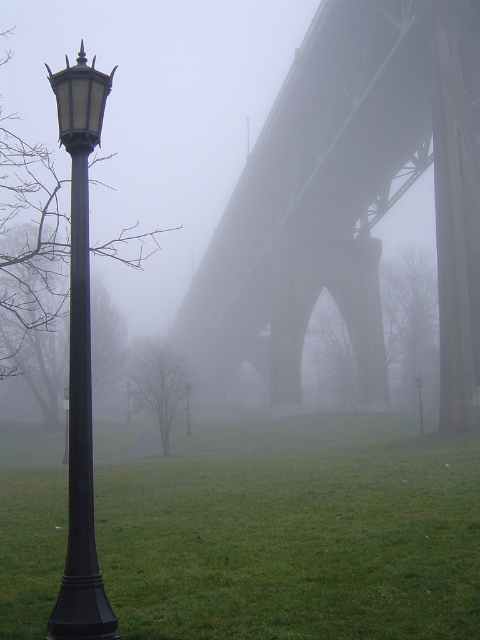
From the picture: Between dark gray concrete suspension bridge at center and matte black lamp post at left, which one has more height?

Standing taller between the two is matte black lamp post at left.

Can you confirm if dark gray concrete suspension bridge at center is positioned to the left of matte black lamp post at left?

No, dark gray concrete suspension bridge at center is not to the left of matte black lamp post at left.

Which is behind, point (383, 176) or point (87, 92)?

Positioned behind is point (383, 176).

Identify the location of dark gray concrete suspension bridge at center. (349, 202).

Who is positioned more to the right, green grass at left or matte black lamp post at center?

From the viewer's perspective, matte black lamp post at center appears more on the right side.

Describe the element at coordinates (295, 531) in the screenshot. I see `green grass at left` at that location.

Where is `green grass at left`? The width and height of the screenshot is (480, 640). green grass at left is located at coordinates (295, 531).

Which is behind, point (81, 259) or point (421, 426)?

Point (421, 426)

Can you confirm if black matte pole at left is positioned to the left of matte black lamp post at center?

Indeed, black matte pole at left is positioned on the left side of matte black lamp post at center.

Which is behind, point (76, 368) or point (421, 406)?

The point (421, 406) is behind.

I want to click on black matte pole at left, so click(81, 444).